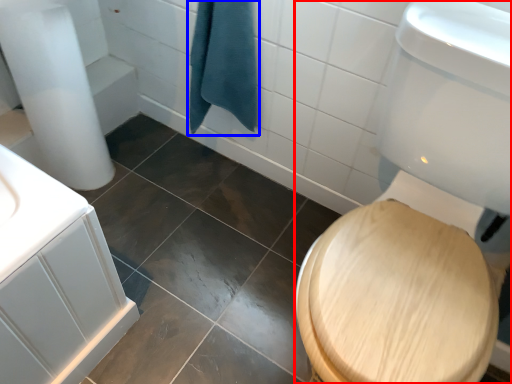
Question: Which object appears closest to the camera in this image, toilet bowl (highlighted by a red box) or bath towel (highlighted by a blue box)?

Choices:
 (A) toilet bowl
 (B) bath towel

Answer: (A)